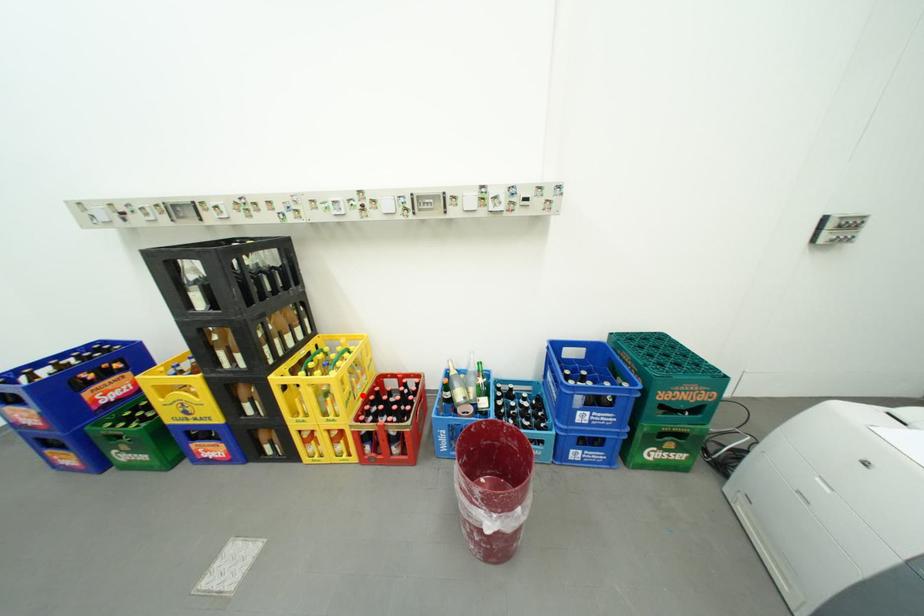
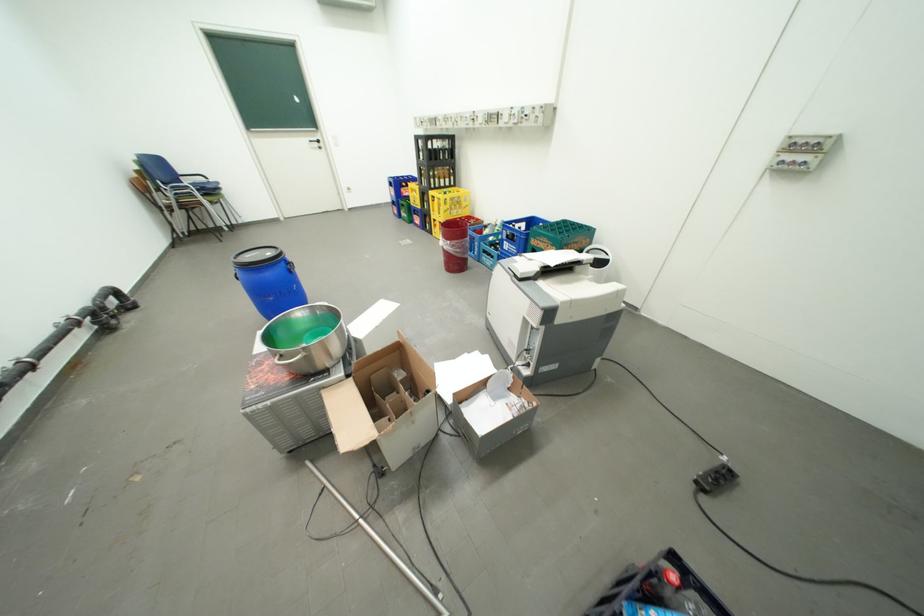
Question: I am providing you with two images of the same scene from different viewpoints. A red point is shown in image1. For the corresponding object point in image2, is it positioned nearer or farther from the camera?

Choices:
 (A) Nearer
 (B) Farther

Answer: (B)